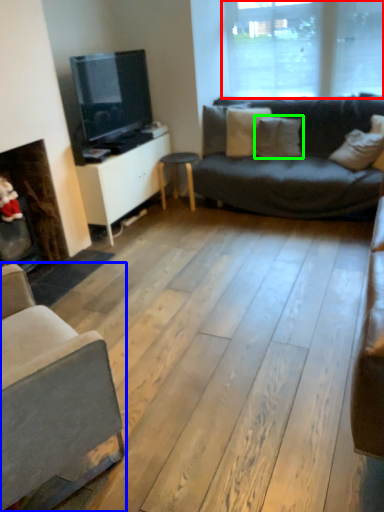
Question: Based on their relative distances, which object is farther from window (highlighted by a red box)? Choose from studio couch (highlighted by a blue box) and pillow (highlighted by a green box).

Choices:
 (A) studio couch
 (B) pillow

Answer: (A)